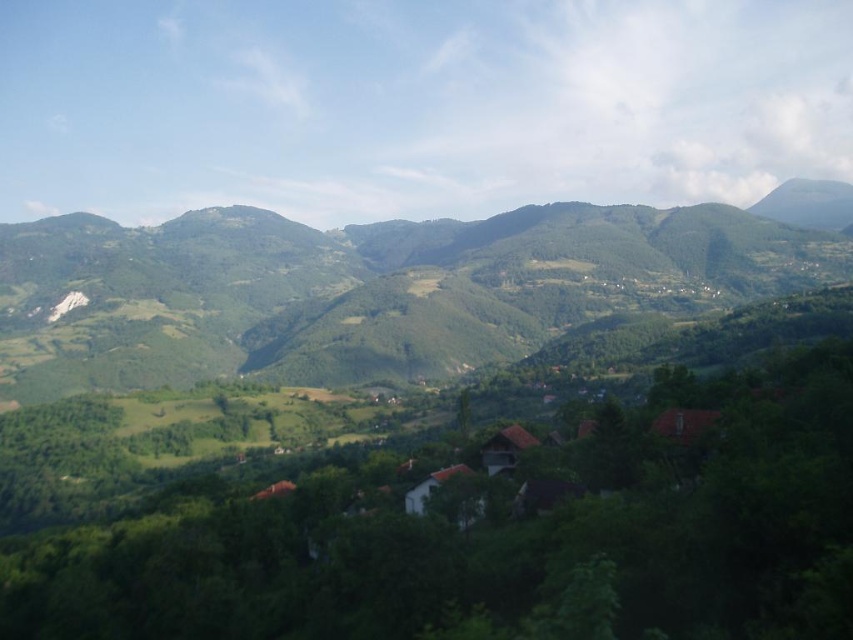
Based on the photo, can you confirm if green leafy mountain at center is positioned below brown tiled roofs at center?

No.

Who is positioned more to the right, green leafy mountain at center or brown tiled roofs at center?

brown tiled roofs at center

This screenshot has height=640, width=853. What do you see at coordinates (445, 429) in the screenshot?
I see `green leafy mountain at center` at bounding box center [445, 429].

I want to click on green leafy mountain at center, so click(x=445, y=429).

Is green leafy mountain at center thinner than green textured hillside at center?

Yes, green leafy mountain at center is thinner than green textured hillside at center.

Does point (706, 403) lie behind point (38, 280)?

No, it is not.

Identify the location of green leafy mountain at center. (445, 429).

Where is `green leafy mountain at center`? green leafy mountain at center is located at coordinates (445, 429).

Between green textured hillside at center and brown tiled roofs at center, which one has less height?

brown tiled roofs at center

Between point (74, 333) and point (412, 509), which one is positioned in front?

Point (412, 509) is in front.

Which is behind, point (367, 227) or point (698, 428)?

The point (367, 227) is behind.

Where is `green textured hillside at center`? green textured hillside at center is located at coordinates (376, 288).